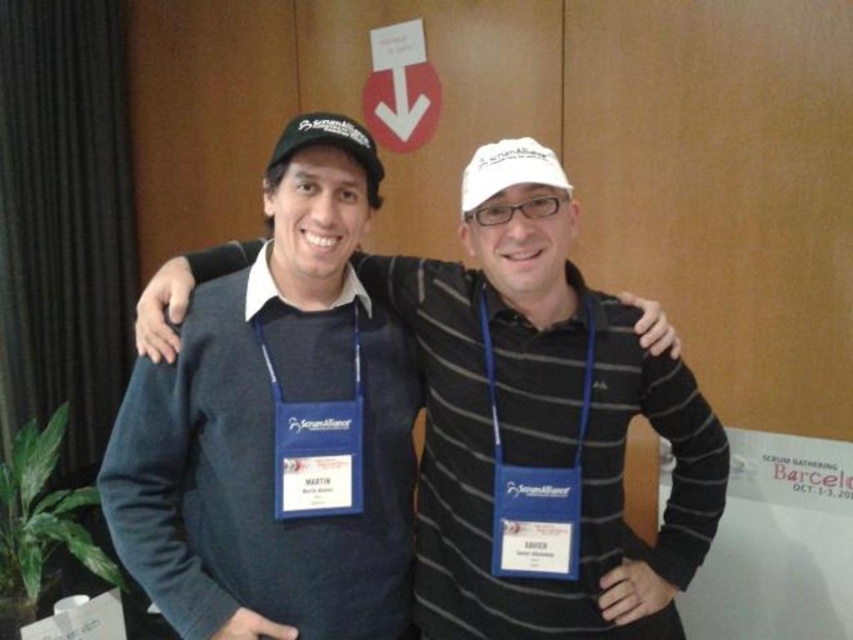
Question: Is white matte baseball cap at center smaller than black matte baseball cap at upper center?

Choices:
 (A) no
 (B) yes

Answer: (B)

Question: Does dark blue sweater at center have a lesser width compared to white matte baseball cap at center?

Choices:
 (A) no
 (B) yes

Answer: (A)

Question: Based on their relative distances, which object is farther from the black matte baseball cap at upper center?

Choices:
 (A) dark blue sweater at center
 (B) white matte baseball cap at center

Answer: (A)

Question: Which object is positioned farthest from the dark blue sweater at center?

Choices:
 (A) white matte baseball cap at center
 (B) black matte baseball cap at upper center

Answer: (B)

Question: Estimate the real-world distances between objects in this image. Which object is closer to the dark blue sweater at center?

Choices:
 (A) black matte baseball cap at upper center
 (B) white matte baseball cap at center

Answer: (B)

Question: Does dark blue sweater at center appear on the right side of white matte baseball cap at center?

Choices:
 (A) yes
 (B) no

Answer: (B)